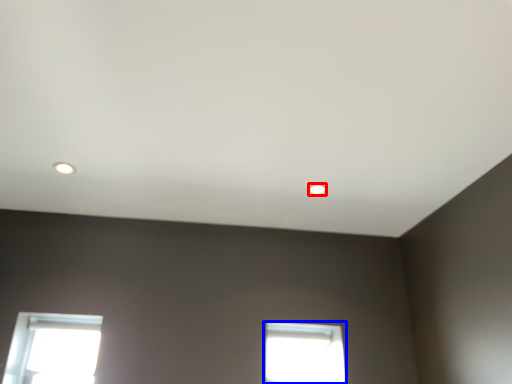
Question: Which point is closer to the camera, lighting (highlighted by a red box) or window (highlighted by a blue box)?

Choices:
 (A) lighting
 (B) window

Answer: (A)